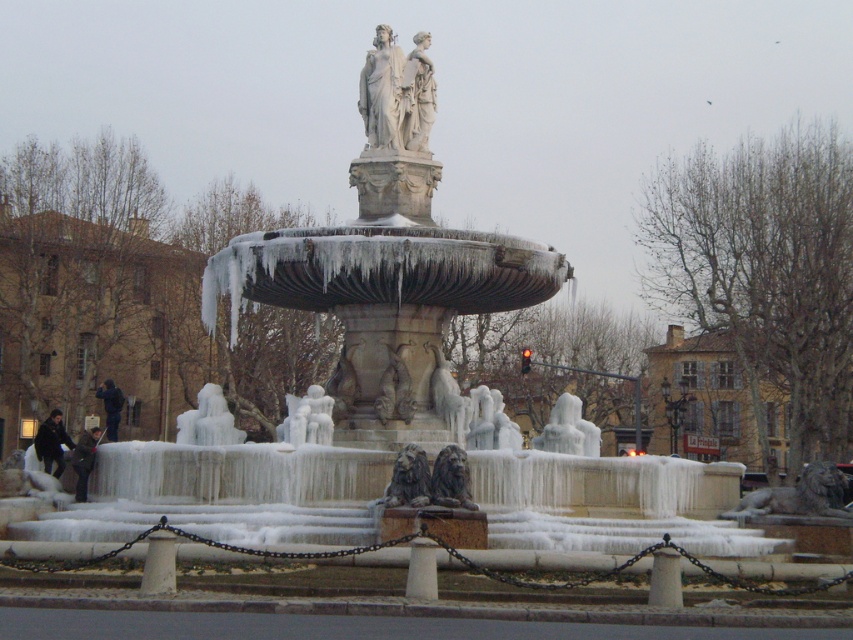
Looking at the frozen fountain in the public square, where are the white marble statues at center in relation to the dark brown stone lion at center?

The white marble statues at center are located to the left of the dark brown stone lion at center.

You are standing in front of the fountain and want to touch both the dark brown stone lion at center and the carved stone lion at center. Which lion should you reach for first?

You should reach for the dark brown stone lion at center first because it is closer to you than the carved stone lion at center.

You are an architect assessing the fountain for maintenance. You need to determine which object, the white marble statues at center or the dark brown stone lion at center, requires a taller ladder for cleaning the highest point. Based on their heights, which one would need the taller ladder?

The white marble statues at center is much taller than the dark brown stone lion at center, so the white marble statues at center would require a taller ladder for cleaning the highest point.